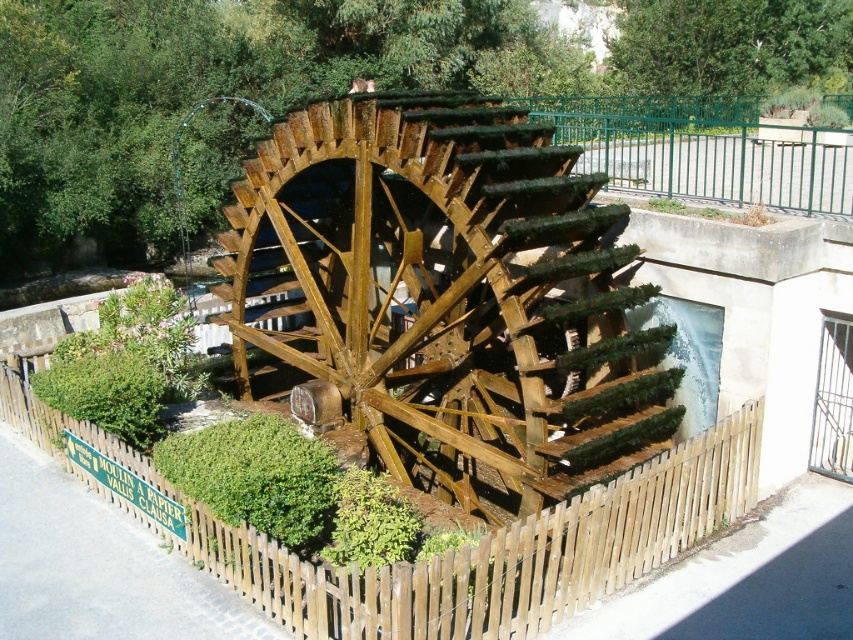
Question: Can you confirm if wooden waterwheel at center is positioned above brown wooden fence at lower center?

Choices:
 (A) no
 (B) yes

Answer: (B)

Question: Is the position of wooden waterwheel at center less distant than that of brown wooden fence at lower center?

Choices:
 (A) no
 (B) yes

Answer: (A)

Question: Does wooden waterwheel at center have a larger size compared to brown wooden fence at lower center?

Choices:
 (A) no
 (B) yes

Answer: (A)

Question: Which point is farther from the camera taking this photo?

Choices:
 (A) (508, 616)
 (B) (402, 163)

Answer: (B)